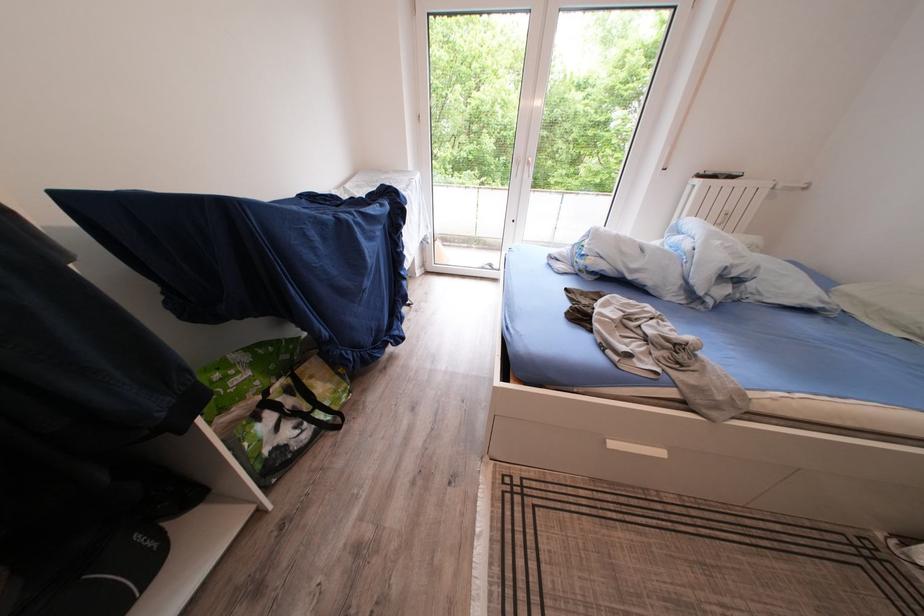
Identify the location of white door handle. The width and height of the screenshot is (924, 616). (524, 166).